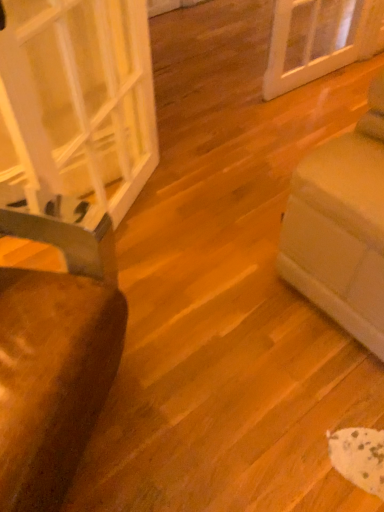
Question: Is the depth of brown fabric chair at left less than that of transparent glass door at left?

Choices:
 (A) no
 (B) yes

Answer: (B)

Question: From the image's perspective, is brown fabric chair at left under transparent glass door at left?

Choices:
 (A) no
 (B) yes

Answer: (B)

Question: Does brown fabric chair at left have a lesser height compared to transparent glass door at left?

Choices:
 (A) no
 (B) yes

Answer: (B)

Question: Can you confirm if brown fabric chair at left is wider than transparent glass door at left?

Choices:
 (A) no
 (B) yes

Answer: (B)

Question: Is brown fabric chair at left further to camera compared to transparent glass door at left?

Choices:
 (A) no
 (B) yes

Answer: (A)

Question: Would you say brown fabric chair at left is a long distance from transparent glass door at left?

Choices:
 (A) yes
 (B) no

Answer: (B)

Question: Is transparent glass door at left next to brown fabric chair at left and touching it?

Choices:
 (A) no
 (B) yes

Answer: (A)

Question: Can you confirm if transparent glass door at left is wider than brown fabric chair at left?

Choices:
 (A) yes
 (B) no

Answer: (B)

Question: Is transparent glass door at left further to camera compared to brown fabric chair at left?

Choices:
 (A) no
 (B) yes

Answer: (B)

Question: Is transparent glass door at left in front of brown fabric chair at left?

Choices:
 (A) no
 (B) yes

Answer: (A)

Question: From a real-world perspective, is transparent glass door at left below brown fabric chair at left?

Choices:
 (A) no
 (B) yes

Answer: (A)

Question: Can you confirm if transparent glass door at left is shorter than brown fabric chair at left?

Choices:
 (A) yes
 (B) no

Answer: (B)

Question: Is transparent glass door at left taller or shorter than brown fabric chair at left?

Choices:
 (A) tall
 (B) short

Answer: (A)